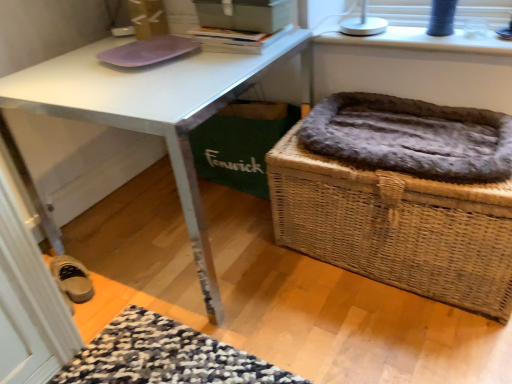
Question: Is hardcover book at upper center bigger or smaller than matte gray box at upper center?

Choices:
 (A) big
 (B) small

Answer: (B)

Question: Considering the relative positions of hardcover book at upper center and matte gray box at upper center in the image provided, is hardcover book at upper center to the left or to the right of matte gray box at upper center?

Choices:
 (A) left
 (B) right

Answer: (A)

Question: Which object is positioned farthest from the white glossy desk at center?

Choices:
 (A) fur-lined wicker basket at right
 (B) fuzzy brown cat bed at lower right
 (C) hardcover book at upper center
 (D) purple matte mousepad at upper left
 (E) white plastic lamp at upper right

Answer: (E)

Question: Estimate the real-world distances between objects in this image. Which object is closer to the white glossy desk at center?

Choices:
 (A) fur-lined wicker basket at right
 (B) white plastic lamp at upper right
 (C) hardcover book at upper center
 (D) fuzzy brown cat bed at lower right
 (E) matte gray box at upper center

Answer: (C)